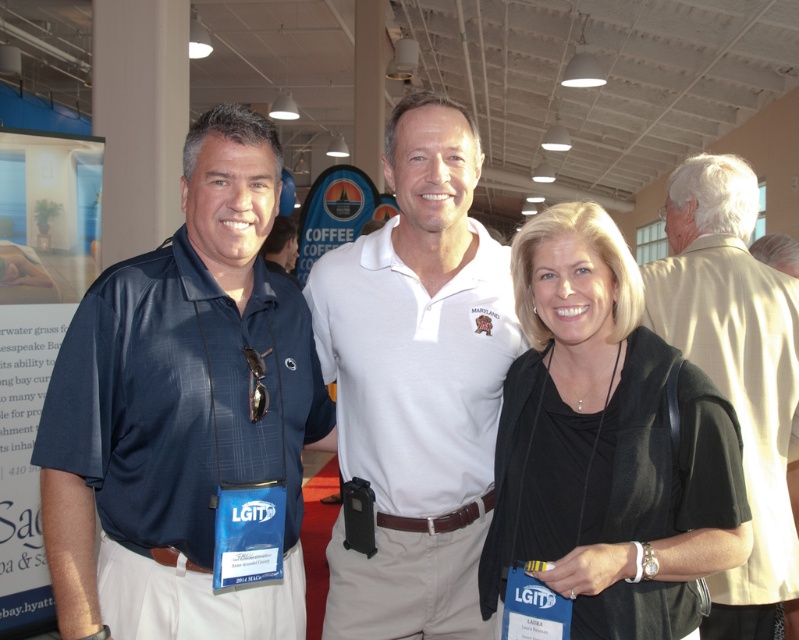
Who is positioned more to the left, white cotton polo shirt at center or beige textured shirt at upper right?

white cotton polo shirt at center is more to the left.

Does point (440, 547) lie behind point (704, 176)?

No, (440, 547) is closer to viewer.

What are the coordinates of `white cotton polo shirt at center` in the screenshot? It's located at (416, 384).

Is point (133, 464) farther from viewer compared to point (372, 602)?

No, it is not.

What do you see at coordinates (181, 408) in the screenshot? I see `matte blue shirt at center` at bounding box center [181, 408].

Identify the location of matte blue shirt at center. (181, 408).

Does matte blue shirt at center lie behind beige textured shirt at upper right?

No, it is in front of beige textured shirt at upper right.

Image resolution: width=799 pixels, height=640 pixels. Find the location of `matte blue shirt at center`. matte blue shirt at center is located at coordinates (181, 408).